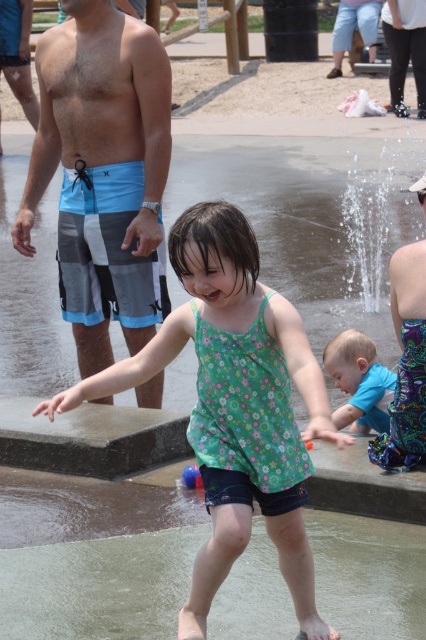
You are designing a storage system for the splash pad area. You need to store the blue striped board shorts at left and the blue cotton shirt at lower center. Which item requires more storage space?

The blue striped board shorts at left requires more storage space because it has a larger size compared to the blue cotton shirt at lower center.

You are a photographer trying to capture a candid shot of both the green floral dress at center and the blue cotton shirt at lower center. Since you want to ensure both are in focus, which object should you adjust your camera focus on first to account for their sizes?

The green floral dress at center is bigger than the blue cotton shirt at lower center, so you should focus on the green floral dress at center first to ensure both are in focus.